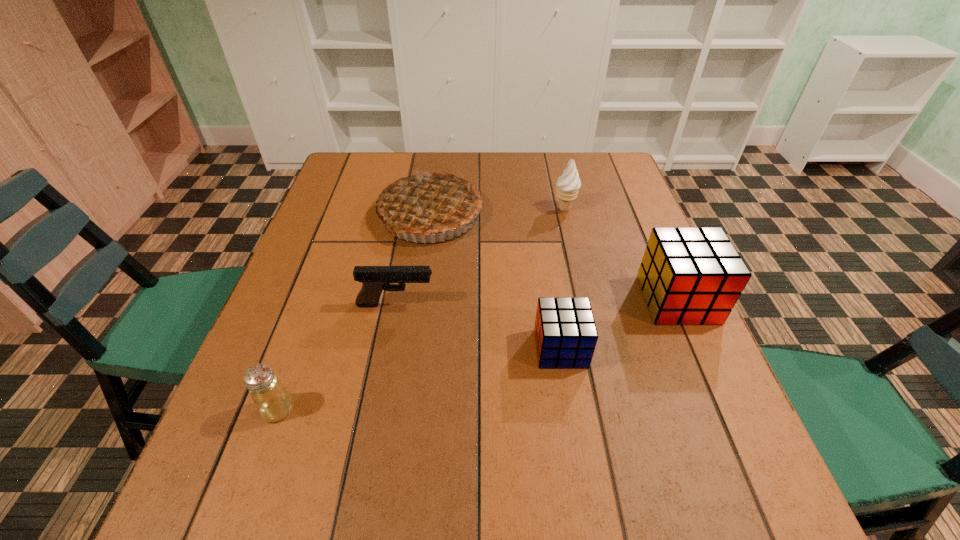
The height and width of the screenshot is (540, 960). Identify the location of the shorter cube. (565, 332).

Image resolution: width=960 pixels, height=540 pixels. In order to click on the left cube in this screenshot , I will do `click(565, 332)`.

The height and width of the screenshot is (540, 960). What are the coordinates of `the right cube` in the screenshot? It's located at [x=688, y=275].

Identify the location of the taller cube. This screenshot has width=960, height=540. (688, 275).

At what (x,y) coordinates should I click in order to perform the action: click on pie. Please return your answer as a coordinate pair (x, y). Looking at the image, I should click on (431, 201).

The width and height of the screenshot is (960, 540). What are the coordinates of `icecream` in the screenshot? It's located at (568, 184).

This screenshot has width=960, height=540. Identify the location of the nearest object. (273, 402).

The width and height of the screenshot is (960, 540). In order to click on saltshaker in this screenshot , I will do `click(273, 402)`.

Find the location of a particular element. The width and height of the screenshot is (960, 540). pistol is located at coordinates (374, 279).

The height and width of the screenshot is (540, 960). What are the coordinates of `vacant space located 0.200m on the back of the shorter cube` in the screenshot? It's located at (547, 265).